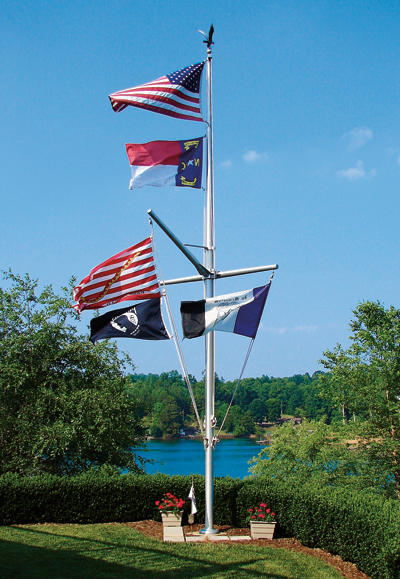
Image resolution: width=400 pixels, height=579 pixels. What are the coordinates of `flower pot` in the screenshot? It's located at (262, 530), (174, 521).